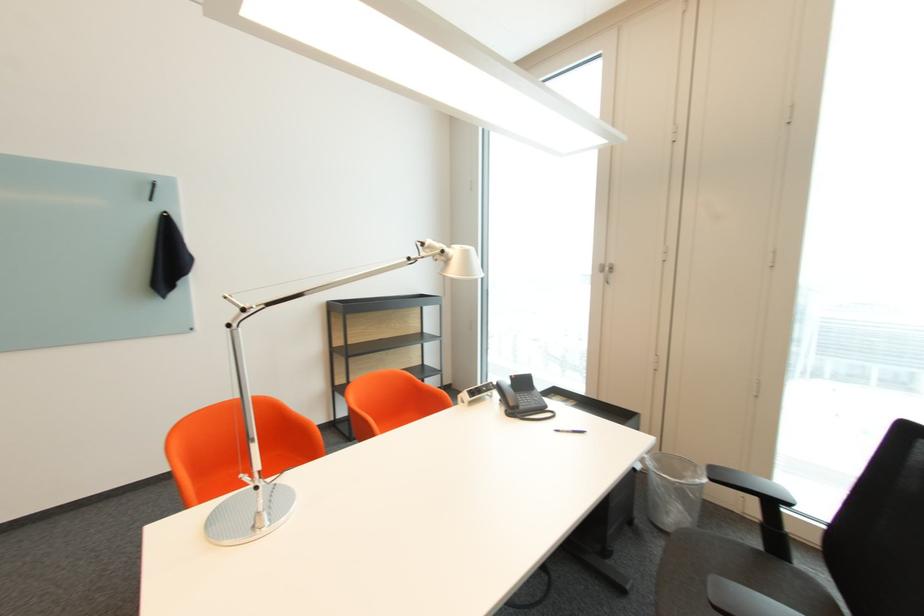
The height and width of the screenshot is (616, 924). What do you see at coordinates (233, 445) in the screenshot?
I see `the orange chair sitting surface` at bounding box center [233, 445].